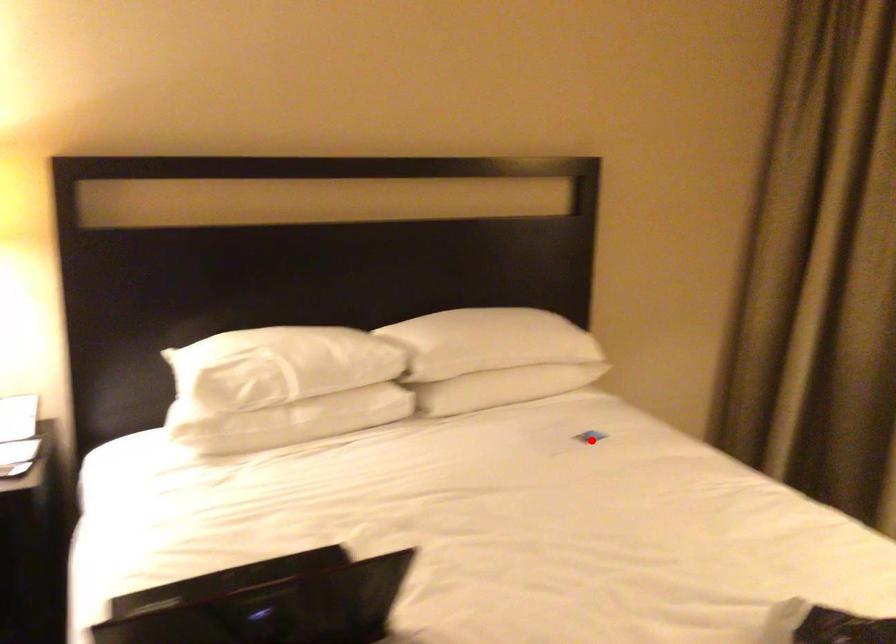
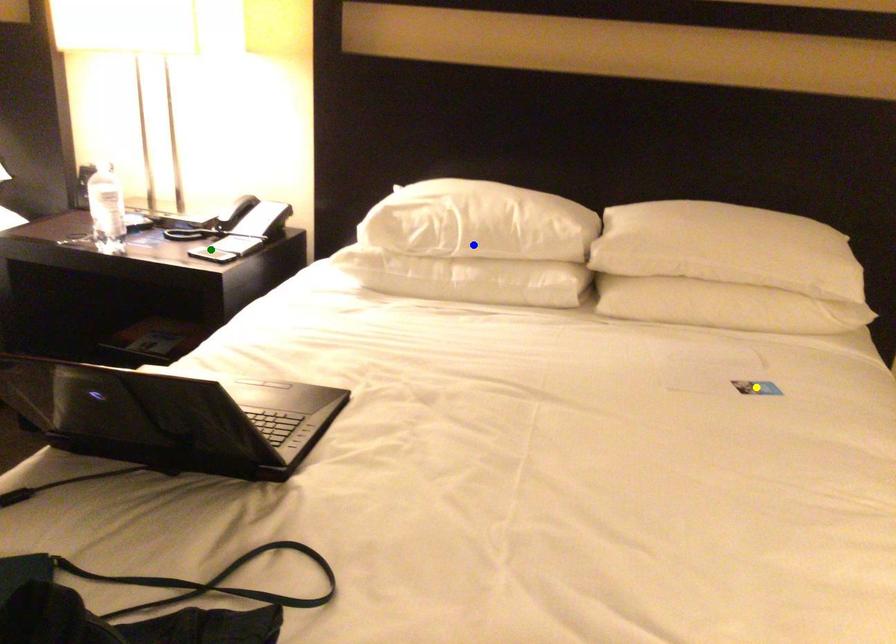
Question: I am providing you with two images of the same scene from different viewpoints. A red point is marked on the first image. You are given multiple points on the second image. Which point in image 2 is actually the same real-world point as the red point in image 1?

Choices:
 (A) green point
 (B) yellow point
 (C) blue point

Answer: (B)